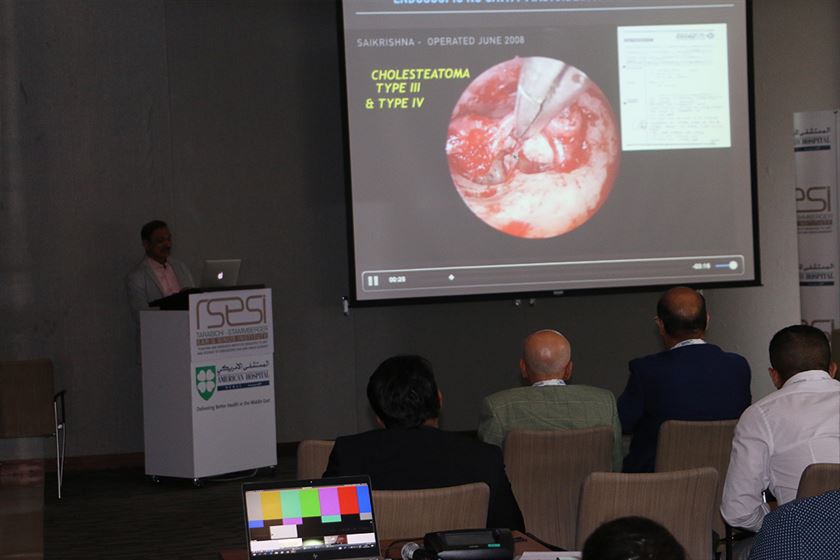
This screenshot has height=560, width=840. Identify the location of display. (358, 503).